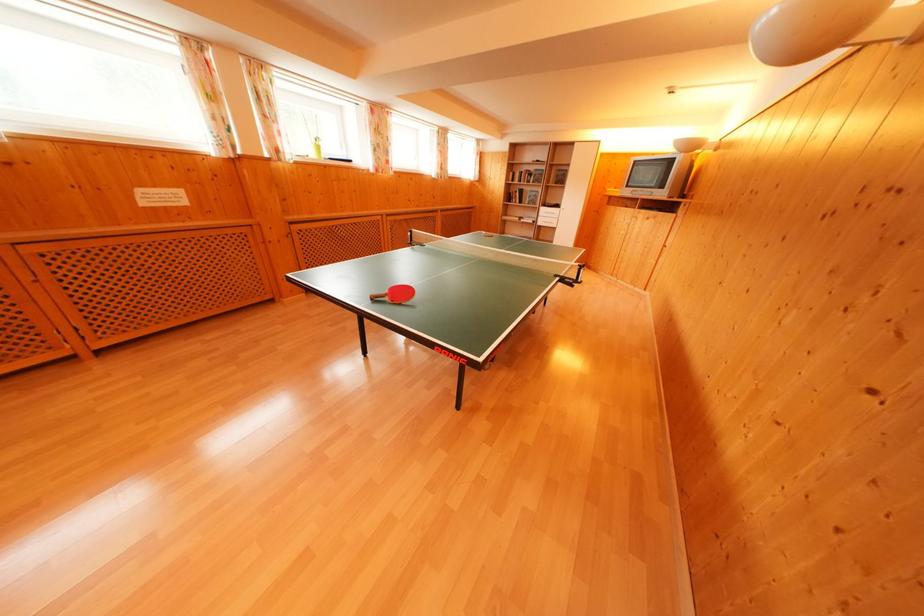
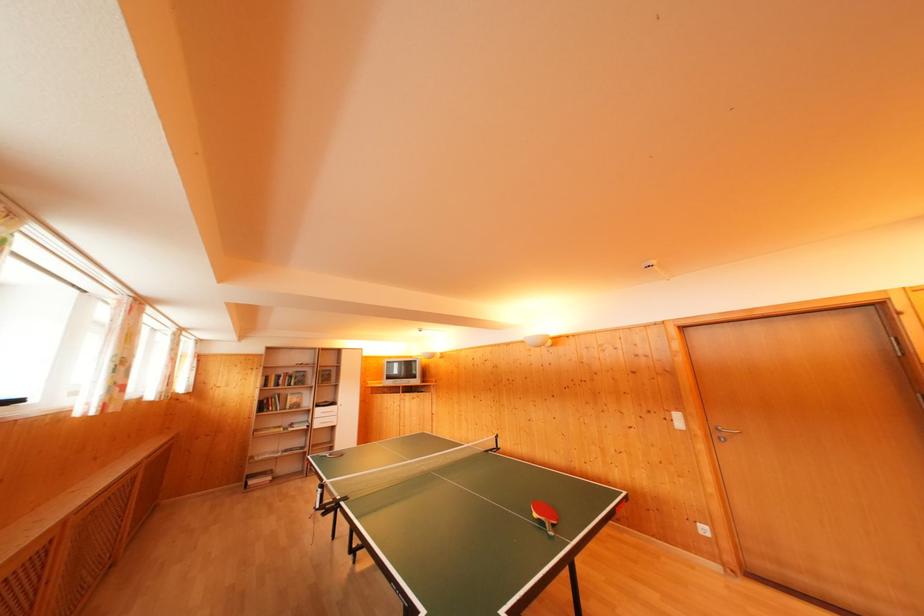
Where in the second image is the point corresponding to [514,203] from the first image?

(268, 411)